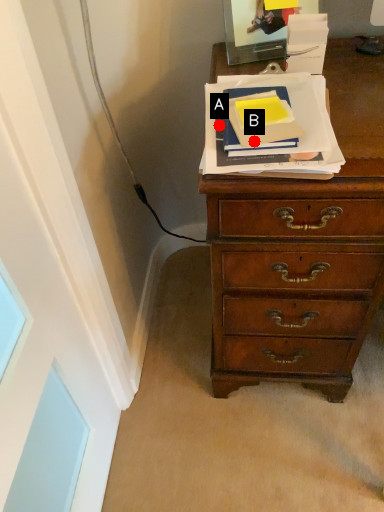
Question: Two points are circled on the image, labeled by A and B beside each circle. Which point is farther to the camera?

Choices:
 (A) A is further
 (B) B is further

Answer: (A)